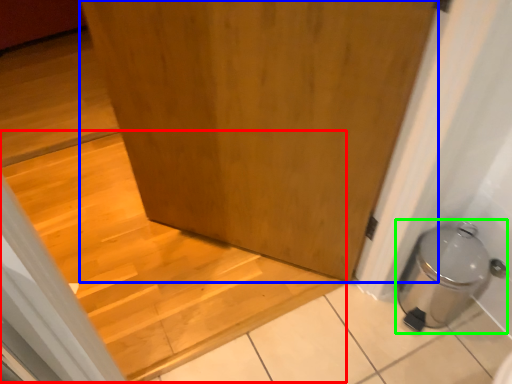
Question: Estimate the real-world distances between objects in this image. Which object is closer to stairwell (highlighted by a red box), door (highlighted by a blue box) or water heater (highlighted by a green box)?

Choices:
 (A) door
 (B) water heater

Answer: (A)